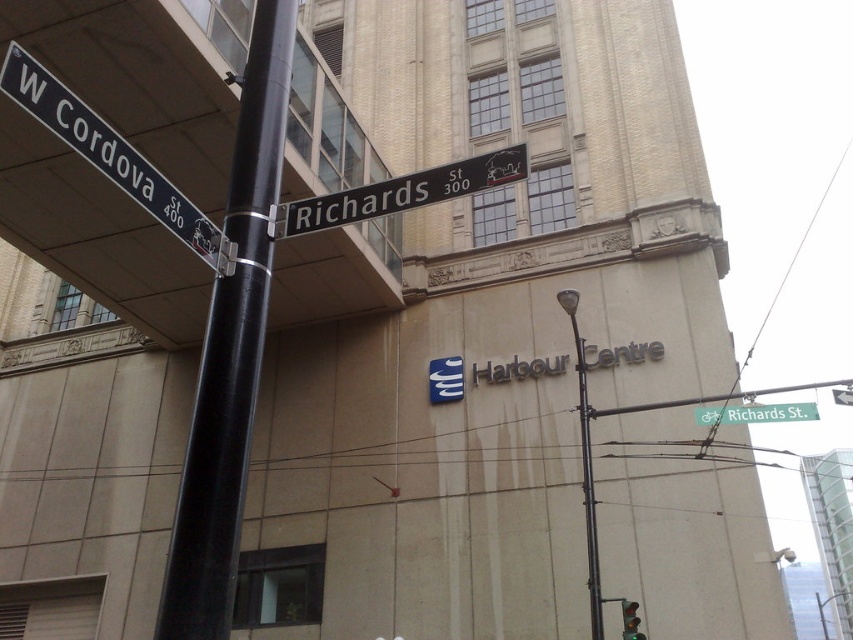
Based on the photo, you are a delivery driver approaching the intersection of W Cordova St and Richards St. You see the black metal street sign at center and the green metallic street sign at upper center. Which one is positioned higher up in the scene?

The black metal street sign at center is located above the green metallic street sign at upper center, so the black metal street sign at center is positioned higher up in the scene.

You are a delivery driver navigating through the city and need to locate the Harbour Centre building. You see a white plastic street sign at upper left. Based on its position, can you estimate the coordinates of the Harbour Centre building?

The white plastic street sign at upper left is at point (112,156), so the Harbour Centre building is likely located near that coordinate.